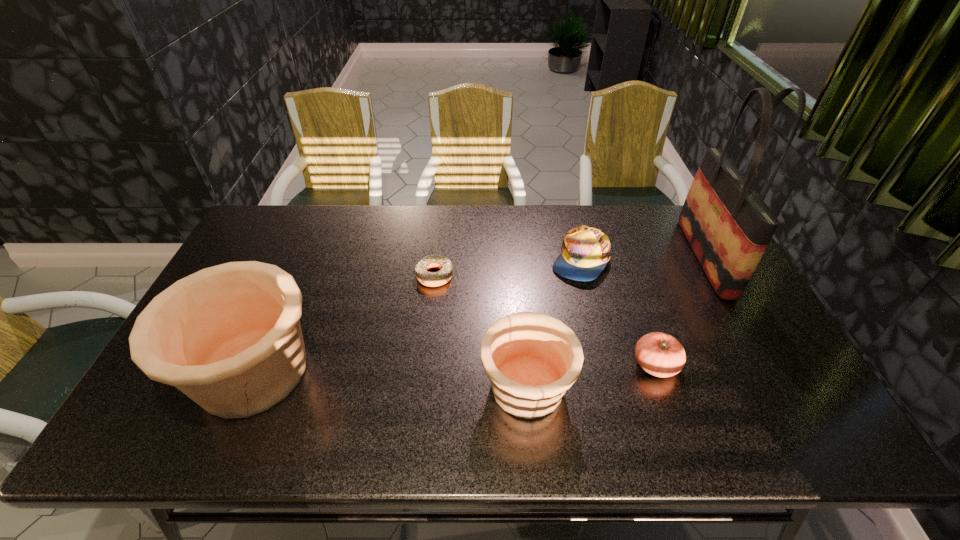
Find the location of a particular element. The height and width of the screenshot is (540, 960). free space between the left pottery and the third tallest object is located at coordinates (390, 380).

Locate an element on the screen. The image size is (960, 540). unoccupied area between the fifth object from right to left and the shorter pottery is located at coordinates (481, 331).

Find the location of `free space between the cap and the taller pottery`. free space between the cap and the taller pottery is located at coordinates (417, 316).

The height and width of the screenshot is (540, 960). I want to click on vacant space that is in between the taller pottery and the cap, so click(417, 316).

Where is `free spot between the shorter pottery and the rightmost object`? free spot between the shorter pottery and the rightmost object is located at coordinates (616, 322).

Locate an element on the screen. Image resolution: width=960 pixels, height=540 pixels. empty location between the tomato and the cap is located at coordinates (617, 312).

Identify which object is located as the fourth nearest to the tomato. Please provide its 2D coordinates. Your answer should be formatted as a tuple, i.e. [(x, y)], where the tuple contains the x and y coordinates of a point satisfying the conditions above.

[(431, 279)]

Locate an element on the screen. object that stands as the fifth closest to the tomato is located at coordinates (229, 337).

Identify the location of vacant space that satisfies the following two spatial constraints: 1. on the front side of the right pottery; 2. on the right side of the taller pottery. This screenshot has height=540, width=960. (247, 387).